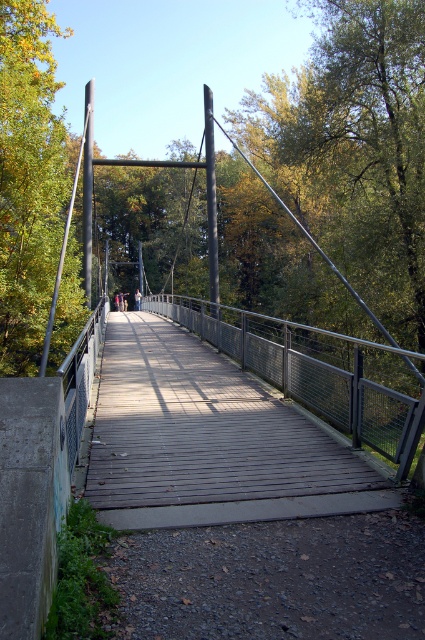
You are standing on the suspension bridge and looking at two points marked on the image. The first point is at coordinate point [221,406] and the second is at point [283,330]. Which point is closer to your current position?

Point [221,406] is closer to the camera than point [283,330], so the first point is closer to your current position.

You are standing at the entrance of the pedestrian suspension bridge and want to know where the wooden planks at center are located. Based on the coordinates provided, can you determine their position relative to the bridge?

The wooden planks at center are located at coordinates point [207,440], which places them near the middle section of the bridge.